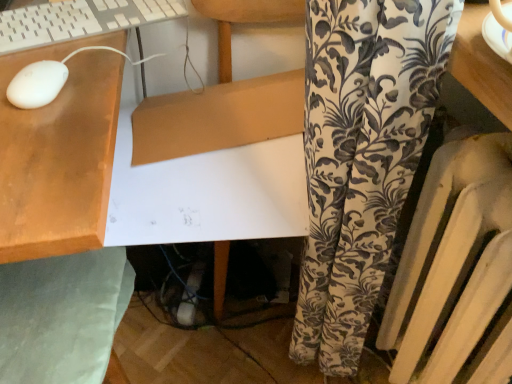
Question: Does white matte mouse at upper left have a smaller size compared to white plastic keyboard at upper left?

Choices:
 (A) no
 (B) yes

Answer: (B)

Question: Considering the relative positions of white matte mouse at upper left and white plastic keyboard at upper left in the image provided, is white matte mouse at upper left in front of white plastic keyboard at upper left?

Choices:
 (A) no
 (B) yes

Answer: (B)

Question: From the image's perspective, does white matte mouse at upper left appear higher than white plastic keyboard at upper left?

Choices:
 (A) no
 (B) yes

Answer: (A)

Question: Is white matte mouse at upper left with white plastic keyboard at upper left?

Choices:
 (A) no
 (B) yes

Answer: (A)

Question: Can you confirm if white matte mouse at upper left is shorter than white plastic keyboard at upper left?

Choices:
 (A) yes
 (B) no

Answer: (A)

Question: Is white plastic keyboard at upper left a part of white matte mouse at upper left?

Choices:
 (A) yes
 (B) no

Answer: (B)

Question: Is green fabric swivel chair at lower left at the right side of white matte mouse at upper left?

Choices:
 (A) no
 (B) yes

Answer: (A)

Question: Is green fabric swivel chair at lower left smaller than white matte mouse at upper left?

Choices:
 (A) yes
 (B) no

Answer: (B)

Question: Is green fabric swivel chair at lower left at the left side of white matte mouse at upper left?

Choices:
 (A) no
 (B) yes

Answer: (B)

Question: Can you confirm if green fabric swivel chair at lower left is wider than white matte mouse at upper left?

Choices:
 (A) no
 (B) yes

Answer: (B)

Question: Is green fabric swivel chair at lower left shorter than white matte mouse at upper left?

Choices:
 (A) yes
 (B) no

Answer: (B)

Question: From the image's perspective, does green fabric swivel chair at lower left appear higher than white matte mouse at upper left?

Choices:
 (A) yes
 (B) no

Answer: (B)

Question: Does white plastic radiator at right turn towards green fabric swivel chair at lower left?

Choices:
 (A) no
 (B) yes

Answer: (B)